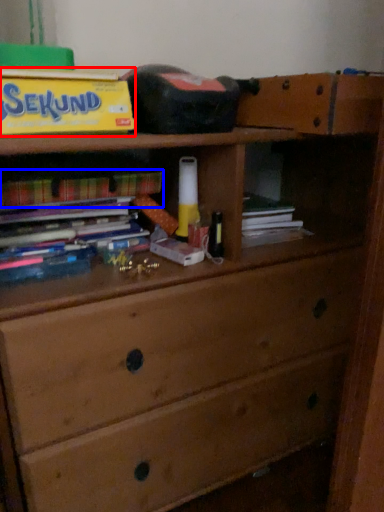
Question: Which of the following is the closest to the observer, paperback book (highlighted by a red box) or book (highlighted by a blue box)?

Choices:
 (A) paperback book
 (B) book

Answer: (A)